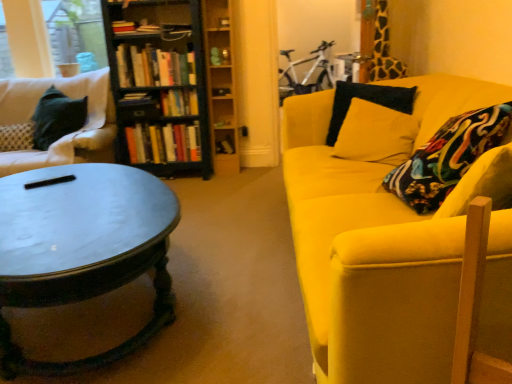
Locate an element on the screen. vacant space in front of wooden shelf at center, arranged as the 2th shelf when viewed from the top is located at coordinates (229, 174).